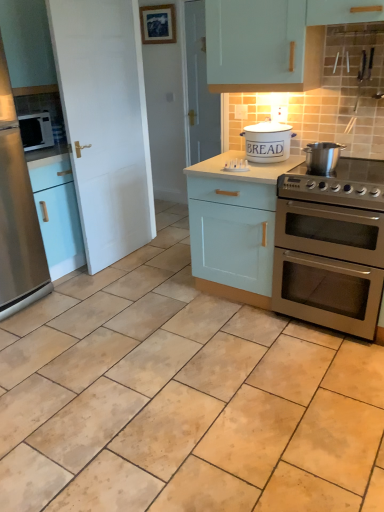
Identify the location of vacant space situated on the left part of white ceramic bread bin at center, the 2th appliance from the front. This screenshot has height=512, width=384. (222, 163).